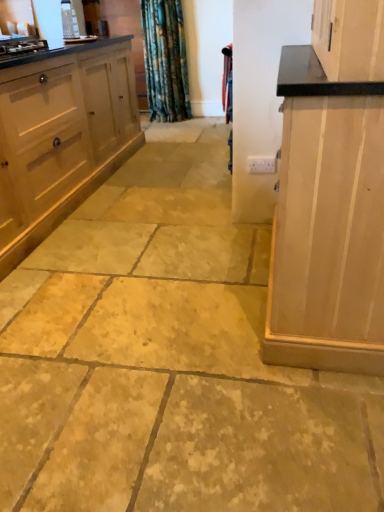
Question: From the image's perspective, does white wood cabinet at left, marked as the second cabinetry in a right-to-left arrangement, appear higher than light wood cabinet at right, which ranks as the 1th cabinetry in right-to-left order?

Choices:
 (A) no
 (B) yes

Answer: (B)

Question: Are white wood cabinet at left, marked as the second cabinetry in a right-to-left arrangement, and light wood cabinet at right, which ranks as the 1th cabinetry in right-to-left order, making contact?

Choices:
 (A) yes
 (B) no

Answer: (B)

Question: Does white wood cabinet at left, positioned as the 1th cabinetry in left-to-right order, appear on the right side of light wood cabinet at right, arranged as the 2th cabinetry when viewed from the left?

Choices:
 (A) no
 (B) yes

Answer: (A)

Question: Is white wood cabinet at left, marked as the second cabinetry in a right-to-left arrangement, positioned beyond the bounds of light wood cabinet at right, which ranks as the 1th cabinetry in right-to-left order?

Choices:
 (A) no
 (B) yes

Answer: (B)

Question: Is white wood cabinet at left, marked as the second cabinetry in a right-to-left arrangement, closer to camera compared to light wood cabinet at right, arranged as the 2th cabinetry when viewed from the left?

Choices:
 (A) no
 (B) yes

Answer: (A)

Question: Does white wood cabinet at left, positioned as the 1th cabinetry in left-to-right order, have a greater width compared to light wood cabinet at right, which ranks as the 1th cabinetry in right-to-left order?

Choices:
 (A) no
 (B) yes

Answer: (B)

Question: Does light wood cabinet at right, which ranks as the 1th cabinetry in right-to-left order, have a lesser width compared to velvet-like red curtain at center?

Choices:
 (A) no
 (B) yes

Answer: (A)

Question: Is light wood cabinet at right, which ranks as the 1th cabinetry in right-to-left order, shorter than velvet-like red curtain at center?

Choices:
 (A) no
 (B) yes

Answer: (A)

Question: Is light wood cabinet at right, arranged as the 2th cabinetry when viewed from the left, oriented towards velvet-like red curtain at center?

Choices:
 (A) no
 (B) yes

Answer: (A)

Question: From the image's perspective, is light wood cabinet at right, which ranks as the 1th cabinetry in right-to-left order, on top of velvet-like red curtain at center?

Choices:
 (A) yes
 (B) no

Answer: (B)

Question: Is light wood cabinet at right, arranged as the 2th cabinetry when viewed from the left, outside velvet-like red curtain at center?

Choices:
 (A) no
 (B) yes

Answer: (B)

Question: Is light wood cabinet at right, which ranks as the 1th cabinetry in right-to-left order, at the left side of velvet-like red curtain at center?

Choices:
 (A) no
 (B) yes

Answer: (A)

Question: Considering the relative sizes of light wood cabinet at right, which ranks as the 1th cabinetry in right-to-left order, and white wood cabinet at left, positioned as the 1th cabinetry in left-to-right order, in the image provided, is light wood cabinet at right, which ranks as the 1th cabinetry in right-to-left order, smaller than white wood cabinet at left, positioned as the 1th cabinetry in left-to-right order,?

Choices:
 (A) no
 (B) yes

Answer: (B)